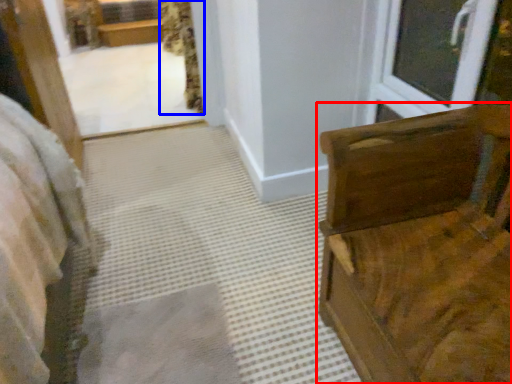
Question: Among these objects, which one is farthest to the camera, furniture (highlighted by a red box) or curtain (highlighted by a blue box)?

Choices:
 (A) furniture
 (B) curtain

Answer: (B)